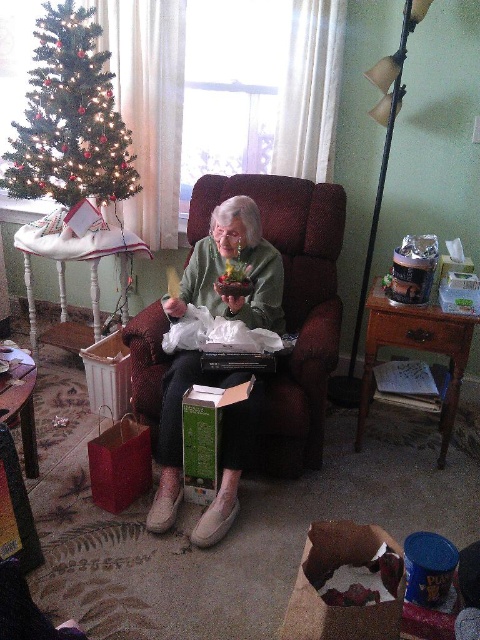
Question: Is brown paper bag at lower center positioned in front of white wood stool at left?

Choices:
 (A) no
 (B) yes

Answer: (B)

Question: Which object is positioned closest to the brown paper bag at lower center?

Choices:
 (A) velvet-like burgundy armchair at center
 (B) green matte christmas tree at upper left

Answer: (A)

Question: Among these points, which one is farthest from the camera?

Choices:
 (A) (80, 83)
 (B) (129, 248)

Answer: (B)

Question: Which point is farther from the camera taking this photo?

Choices:
 (A) (313, 454)
 (B) (322, 541)
 (C) (62, 243)

Answer: (C)

Question: Considering the relative positions of velvet-like burgundy armchair at center and brown paper bag at lower center in the image provided, where is velvet-like burgundy armchair at center located with respect to brown paper bag at lower center?

Choices:
 (A) below
 (B) above

Answer: (B)

Question: In this image, where is brown paper bag at lower center located relative to white wood stool at left?

Choices:
 (A) below
 (B) above

Answer: (A)